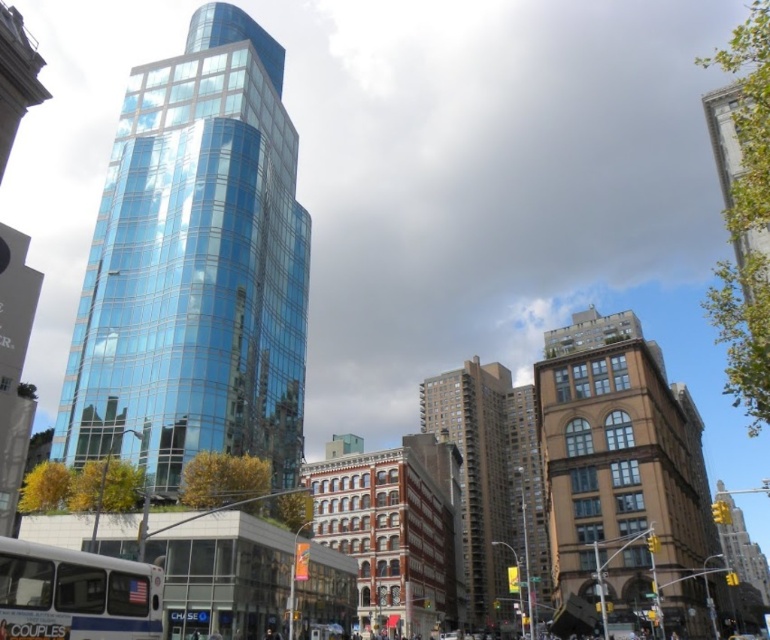
You are a pedestrian standing at the intersection and want to cross the street. You see the white matte bus at lower left and the metallic silver car at center. Which vehicle is closer to you?

The white matte bus at lower left is closer to the viewer than the metallic silver car at center.

Looking at this image, you are standing at the point marked as point (18,588) in the image. A friend is waiting at your current location. They want to know how far they are from you. What should you tell them?

The distance between point (18,588) and the viewer is 25.40 meters, so you should inform your friend that they are 25.40 meters away from you.

You are standing at the busy street intersection in the urban scene. You see two points marked on the ground. The first is at point (24,600) and the second is at point (735,637). Which point is closer to you?

Point (24,600) is in front of point (735,637), so it is closer to you.